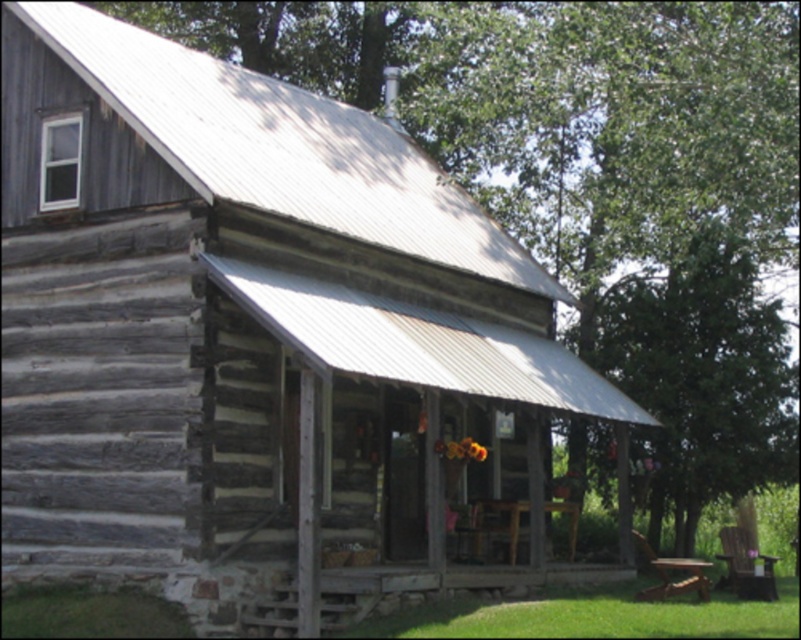
Question: Which object appears farthest from the camera in this image?

Choices:
 (A) green leafy tree at center
 (B) wooden picnic table at center

Answer: (A)

Question: Which point is farther to the camera?

Choices:
 (A) green leafy tree at center
 (B) wooden picnic table at center

Answer: (A)

Question: Which object is farther from the camera taking this photo?

Choices:
 (A) wooden picnic table at center
 (B) green leafy tree at center

Answer: (B)

Question: Does green leafy tree at center lie behind wooden picnic table at center?

Choices:
 (A) yes
 (B) no

Answer: (A)

Question: Is green leafy tree at center above wooden picnic table at center?

Choices:
 (A) yes
 (B) no

Answer: (A)

Question: Considering the relative positions of green leafy tree at center and wooden picnic table at center in the image provided, where is green leafy tree at center located with respect to wooden picnic table at center?

Choices:
 (A) below
 (B) above

Answer: (B)